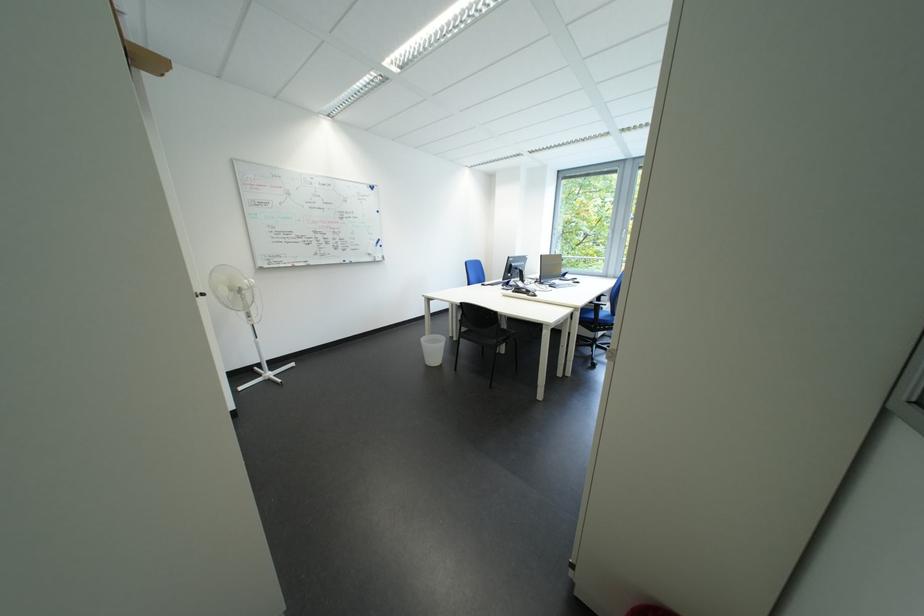
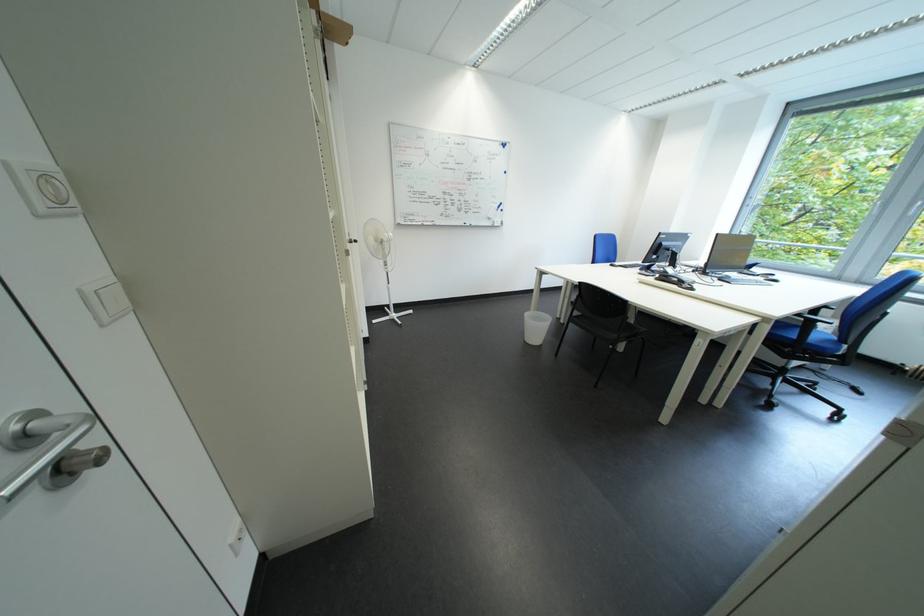
Where in the second image is the point corresponding to (x=468, y=341) from the first image?

(575, 323)